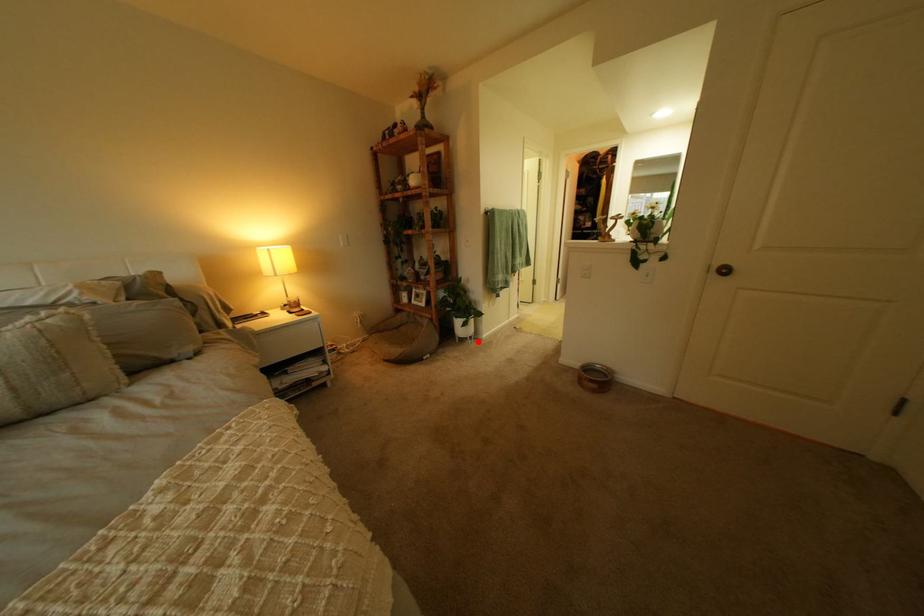
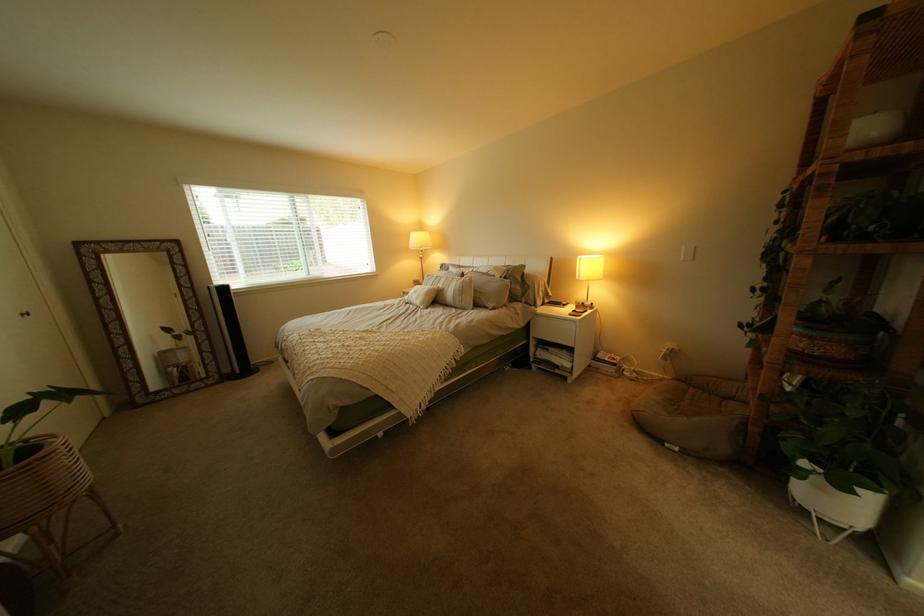
Find the pixel in the second image that matches the highlighted location in the first image.

(821, 512)